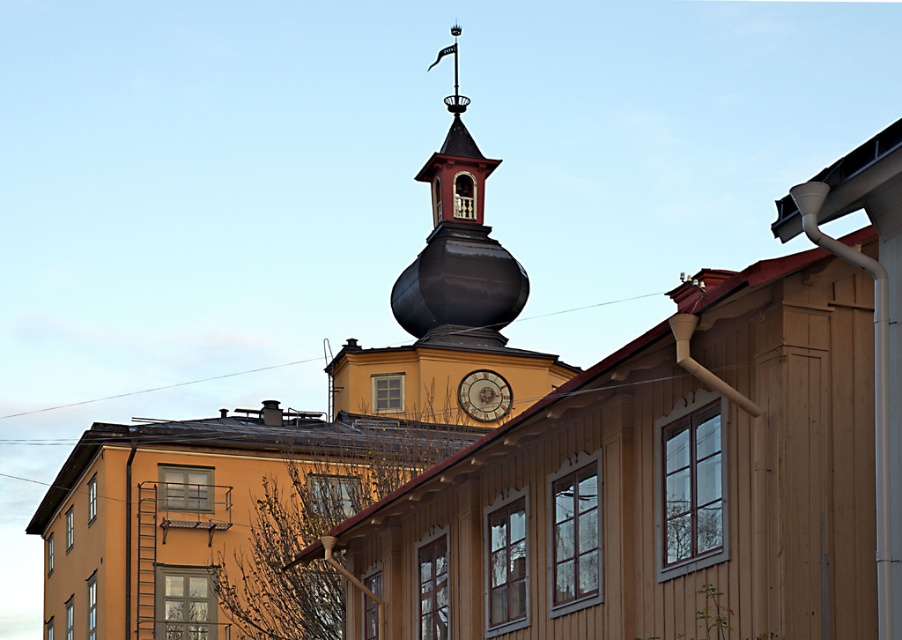
Question: Considering the relative positions of black glossy clock tower at upper center and shiny dark brown bell tower at upper center in the image provided, where is black glossy clock tower at upper center located with respect to shiny dark brown bell tower at upper center?

Choices:
 (A) below
 (B) above

Answer: (A)

Question: Among these objects, which one is farthest from the camera?

Choices:
 (A) black glossy clock tower at upper center
 (B) gold metallic clock at center
 (C) shiny dark brown bell tower at upper center

Answer: (C)

Question: Can you confirm if shiny dark brown bell tower at upper center is positioned to the right of gold metallic clock at center?

Choices:
 (A) no
 (B) yes

Answer: (A)

Question: Which object is the farthest from the shiny dark brown bell tower at upper center?

Choices:
 (A) gold metallic clock at center
 (B) black glossy clock tower at upper center

Answer: (A)

Question: Which of the following is the closest to the observer?

Choices:
 (A) gold metallic clock at center
 (B) black glossy clock tower at upper center

Answer: (B)

Question: Is black glossy clock tower at upper center wider than shiny dark brown bell tower at upper center?

Choices:
 (A) yes
 (B) no

Answer: (A)